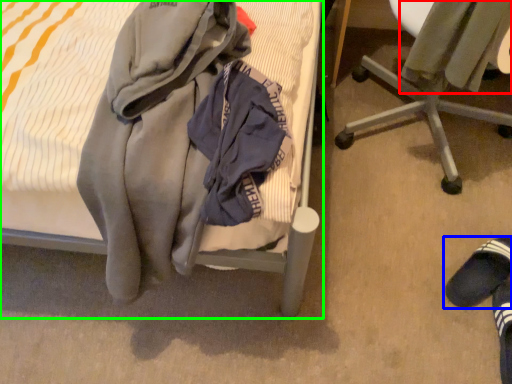
Question: Considering the real-world distances, which object is farthest from sweater (highlighted by a red box)? footwear (highlighted by a blue box) or bed (highlighted by a green box)?

Choices:
 (A) footwear
 (B) bed

Answer: (A)